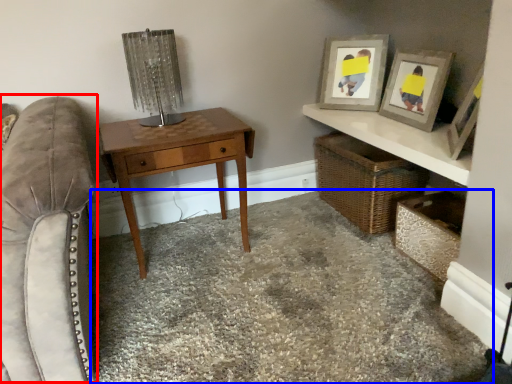
Question: Which object appears farthest to the camera in this image, swivel chair (highlighted by a red box) or concrete (highlighted by a blue box)?

Choices:
 (A) swivel chair
 (B) concrete

Answer: (B)